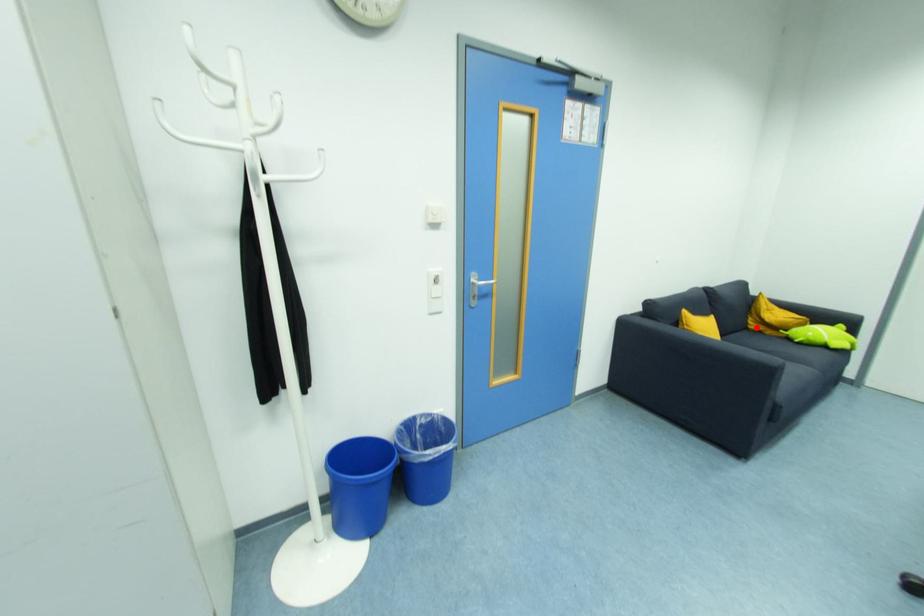
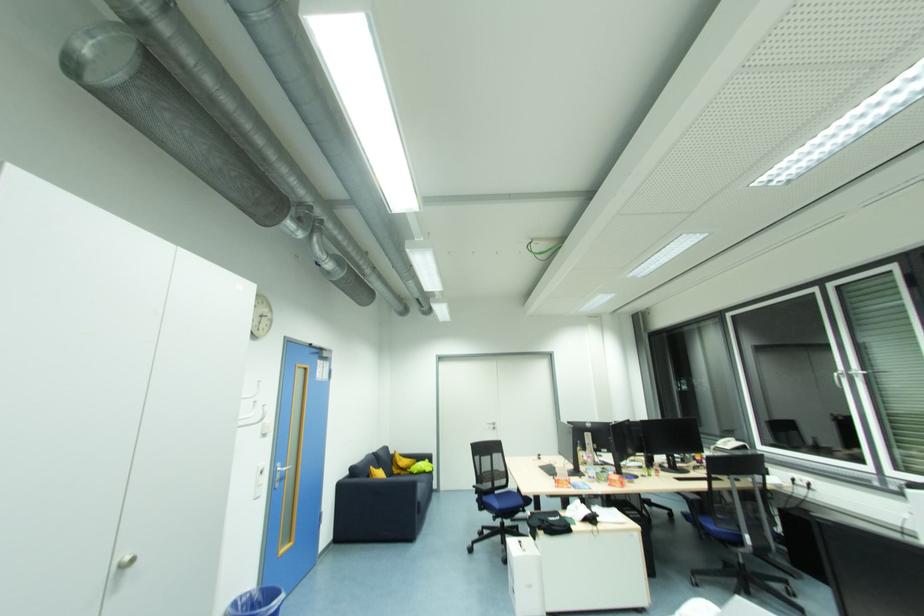
Question: A red point is marked in image1. In image2, is the corresponding 3D point closer to the camera or farther? Reply with the corresponding letter.

Choices:
 (A) The corresponding 3D point is closer.
 (B) The corresponding 3D point is farther.

Answer: (B)